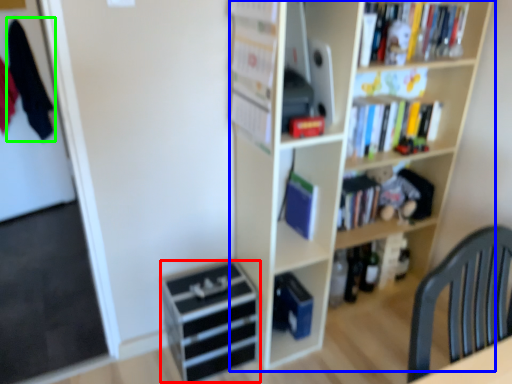
Question: Estimate the real-world distances between objects in this image. Which object is closer to drawer (highlighted by a red box), bookcase (highlighted by a blue box) or clothe (highlighted by a green box)?

Choices:
 (A) bookcase
 (B) clothe

Answer: (A)